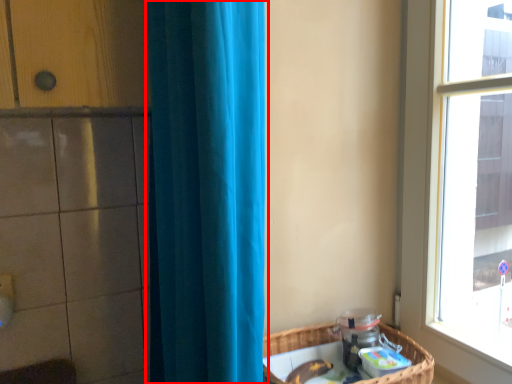
Question: From the image's perspective, what is the correct spatial relationship of curtain (annotated by the red box) in relation to basket?

Choices:
 (A) below
 (B) above

Answer: (B)